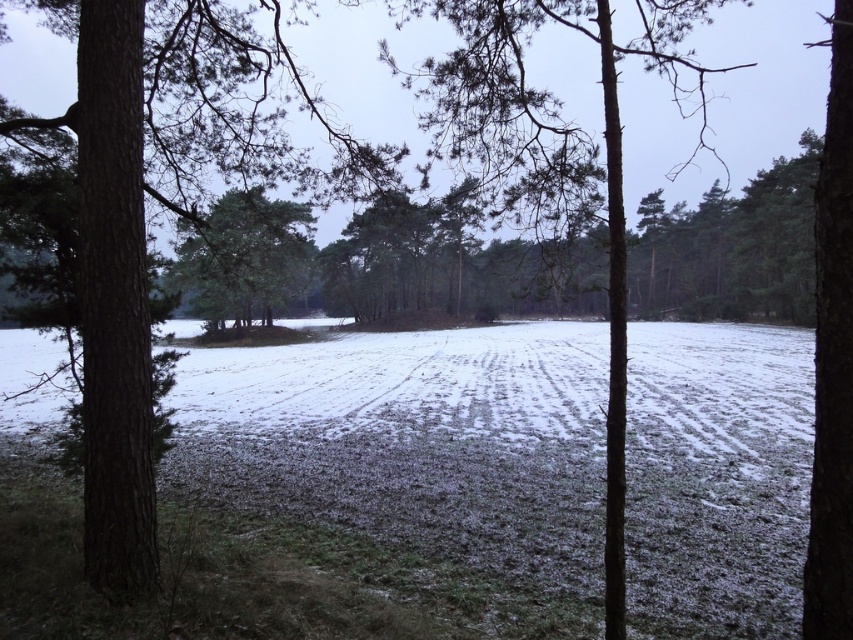
Is brown rough bark tree at left shorter than smooth bark tree at center?

Result: Correct, brown rough bark tree at left is not as tall as smooth bark tree at center.

Is point (105, 566) positioned after point (544, 125)?

No, (105, 566) is in front of (544, 125).

You are a GUI agent. You are given a task and a screenshot of the screen. Output one action in this format:
    pyautogui.click(x=<x>, y=<y>)
    Task: Click on the brown rough bark tree at left
    The height and width of the screenshot is (640, 853).
    Given the screenshot: What is the action you would take?
    pyautogui.click(x=167, y=208)

Does brown rough bark tree at left have a greater height compared to green matte tree at center?

Correct, brown rough bark tree at left is much taller as green matte tree at center.

Can you confirm if brown rough bark tree at left is smaller than green matte tree at center?

Indeed, brown rough bark tree at left has a smaller size compared to green matte tree at center.

Identify the location of brown rough bark tree at left. The image size is (853, 640). (167, 208).

Which is more to the right, smooth bark tree at center or green matte tree at center?

From the viewer's perspective, smooth bark tree at center appears more on the right side.

Does smooth bark tree at center appear on the left side of green matte tree at center?

Incorrect, smooth bark tree at center is not on the left side of green matte tree at center.

Does point (611, 371) lie behind point (309, 276)?

No.

The width and height of the screenshot is (853, 640). What are the coordinates of `smooth bark tree at center` in the screenshot? It's located at (550, 160).